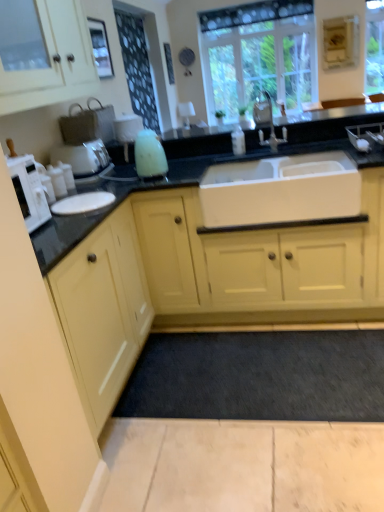
Question: Is white matte sink at center at the right side of matte white coffee machine at left?

Choices:
 (A) yes
 (B) no

Answer: (A)

Question: Can you confirm if white matte sink at center is smaller than matte white coffee machine at left?

Choices:
 (A) no
 (B) yes

Answer: (A)

Question: Considering the relative positions of white matte sink at center and matte white coffee machine at left in the image provided, is white matte sink at center in front of matte white coffee machine at left?

Choices:
 (A) yes
 (B) no

Answer: (A)

Question: From the image's perspective, is white matte sink at center on top of matte white coffee machine at left?

Choices:
 (A) yes
 (B) no

Answer: (B)

Question: Is white matte sink at center oriented away from matte white coffee machine at left?

Choices:
 (A) yes
 (B) no

Answer: (B)

Question: From their relative heights in the image, would you say matte white cabinet at upper left, arranged as the second cabinetry when ordered from the bottom, is taller or shorter than silver metallic faucet at center?

Choices:
 (A) short
 (B) tall

Answer: (B)

Question: Is matte white cabinet at upper left, arranged as the first cabinetry when viewed from the top, inside the boundaries of silver metallic faucet at center, or outside?

Choices:
 (A) outside
 (B) inside

Answer: (A)

Question: Relative to silver metallic faucet at center, is matte white cabinet at upper left, arranged as the second cabinetry when ordered from the bottom, in front or behind?

Choices:
 (A) front
 (B) behind

Answer: (A)

Question: Visually, is matte white cabinet at upper left, arranged as the second cabinetry when ordered from the bottom, positioned to the left or to the right of silver metallic faucet at center?

Choices:
 (A) left
 (B) right

Answer: (A)

Question: Does point (261, 70) appear closer or farther from the camera than point (130, 370)?

Choices:
 (A) farther
 (B) closer

Answer: (A)

Question: From the image's perspective, is clear glass window at upper center located above or below matte yellow cabinet at left, the 1th cabinetry in the bottom-to-top sequence?

Choices:
 (A) above
 (B) below

Answer: (A)

Question: Is clear glass window at upper center to the left or to the right of matte yellow cabinet at left, the 1th cabinetry in the bottom-to-top sequence, in the image?

Choices:
 (A) right
 (B) left

Answer: (A)

Question: Looking at the image, does clear glass window at upper center seem bigger or smaller compared to matte yellow cabinet at left, the 1th cabinetry in the bottom-to-top sequence?

Choices:
 (A) big
 (B) small

Answer: (B)

Question: Visually, is black granite countertop at center positioned to the left or to the right of matte yellow cabinet at left, the 1th cabinetry in the bottom-to-top sequence?

Choices:
 (A) right
 (B) left

Answer: (A)

Question: Do you think black granite countertop at center is within matte yellow cabinet at left, the 2th cabinetry when ordered from top to bottom, or outside of it?

Choices:
 (A) outside
 (B) inside

Answer: (A)